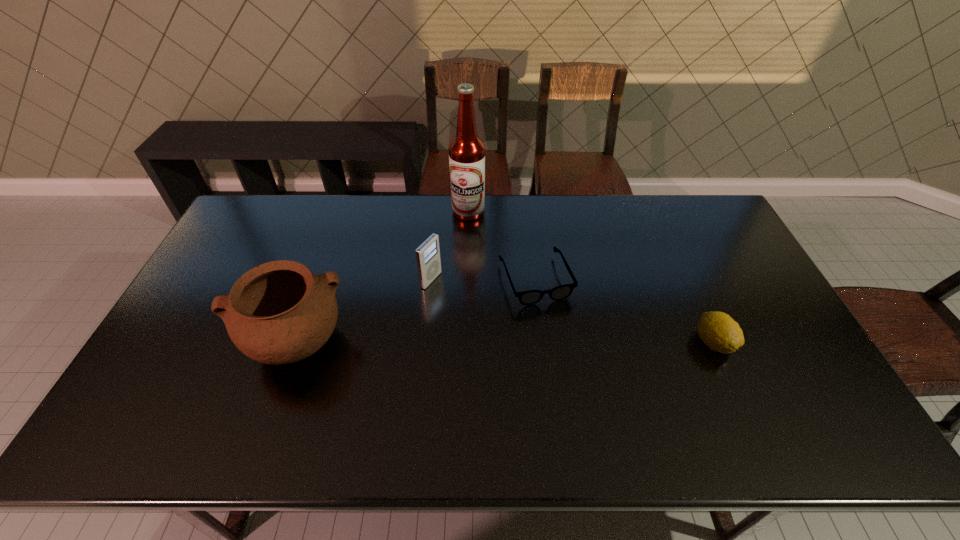
Image resolution: width=960 pixels, height=540 pixels. Find the location of `vacant space situated 0.150m on the left of the pottery`. vacant space situated 0.150m on the left of the pottery is located at coordinates pyautogui.click(x=187, y=342).

You are a GUI agent. You are given a task and a screenshot of the screen. Output one action in this format:
    pyautogui.click(x=<x>, y=<y>)
    Task: Click on the vacant region located at the stem end of the lemon
    The height and width of the screenshot is (540, 960).
    Given the screenshot: What is the action you would take?
    pyautogui.click(x=732, y=382)

The height and width of the screenshot is (540, 960). Identify the location of free region located 0.090m on the arms of the shortest object. (557, 332).

Where is `vacant space situated on the arms of the shortest object`? vacant space situated on the arms of the shortest object is located at coordinates (572, 367).

Image resolution: width=960 pixels, height=540 pixels. I want to click on blank space located on the arms of the shortest object, so click(x=561, y=340).

The width and height of the screenshot is (960, 540). Identify the location of free space located on the front-facing side of the third shortest object. (532, 328).

Locate an element on the screen. The image size is (960, 540). vacant space situated on the front-facing side of the third shortest object is located at coordinates (467, 298).

Find the location of a particular element. The image size is (960, 540). free space located 0.240m on the front-facing side of the third shortest object is located at coordinates (507, 317).

Find the location of a particular element. The height and width of the screenshot is (540, 960). vacant space located on the label side of the alcohol is located at coordinates (471, 237).

At what (x,y) coordinates should I click in order to perform the action: click on free space located on the label side of the alcohol. Please return your answer as a coordinate pair (x, y). The image size is (960, 540). Looking at the image, I should click on (479, 300).